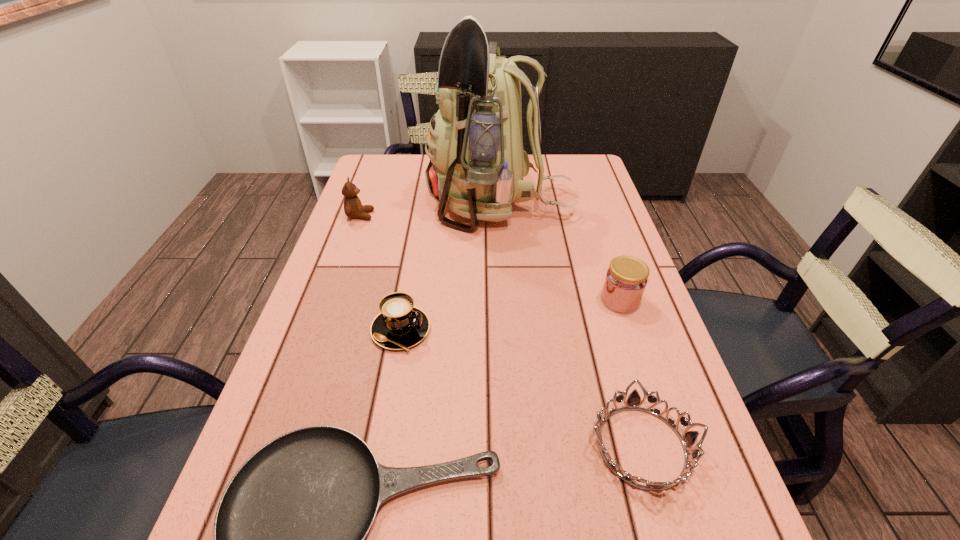
Identify the location of backpack. (477, 163).

Where is `teddy bear`? The width and height of the screenshot is (960, 540). teddy bear is located at coordinates (353, 208).

This screenshot has height=540, width=960. Identify the location of jam. (626, 279).

You are a GUI agent. You are given a task and a screenshot of the screen. Output one action in this format:
    pyautogui.click(x=<x>, y=<y>)
    Task: Click on the cappuccino
    
    Given the screenshot: What is the action you would take?
    pyautogui.click(x=400, y=325)

Where is `tiara`? The height and width of the screenshot is (540, 960). tiara is located at coordinates (688, 439).

Locate an element on the screen. This screenshot has height=540, width=960. free space located 0.060m on the front-facing side of the tallest object is located at coordinates click(x=408, y=205).

Identify the location of vacant region located on the front-facing side of the tallest object. (412, 205).

Locate an element on the screen. The image size is (960, 540). free location located on the front-facing side of the tallest object is located at coordinates (355, 205).

Locate an element on the screen. free space located at the face of the teddy bear is located at coordinates (421, 215).

The image size is (960, 540). Find the location of `free space located 0.130m on the left of the jam`. free space located 0.130m on the left of the jam is located at coordinates (544, 300).